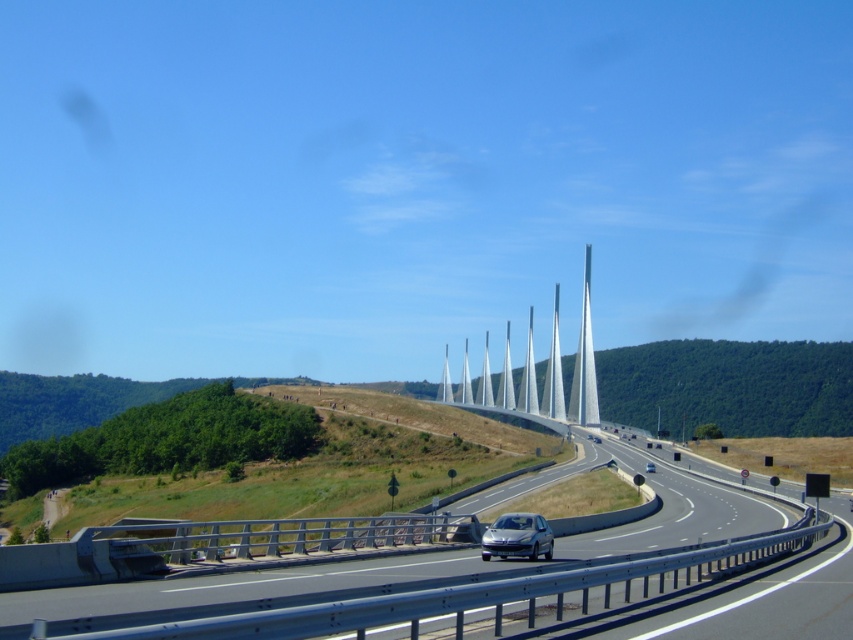
You are a drone operator tasked with capturing aerial footage of the highway bridge. Your drone is currently hovering at point (517, 536). What object is located exactly at your current position?

The satin silver car at center is located exactly at point (517, 536).

You are a driver planning to overtake the satin silver car at center on the gray asphalt highway at center. Considering the highway and car widths, can you safely perform a lane change without crossing the road edge?

The gray asphalt highway at center is wider than the satin silver car at center, so yes, you can safely perform a lane change without crossing the road edge as there is sufficient space.

You are a pedestrian standing on the sidewalk next to the gray asphalt highway at center. You see a silver metallic car at center approaching you. Is the car coming towards you or moving away?

The gray asphalt highway at center is closer to the viewer than silver metallic car at center, so the car is moving away from you since it is further back on the highway.